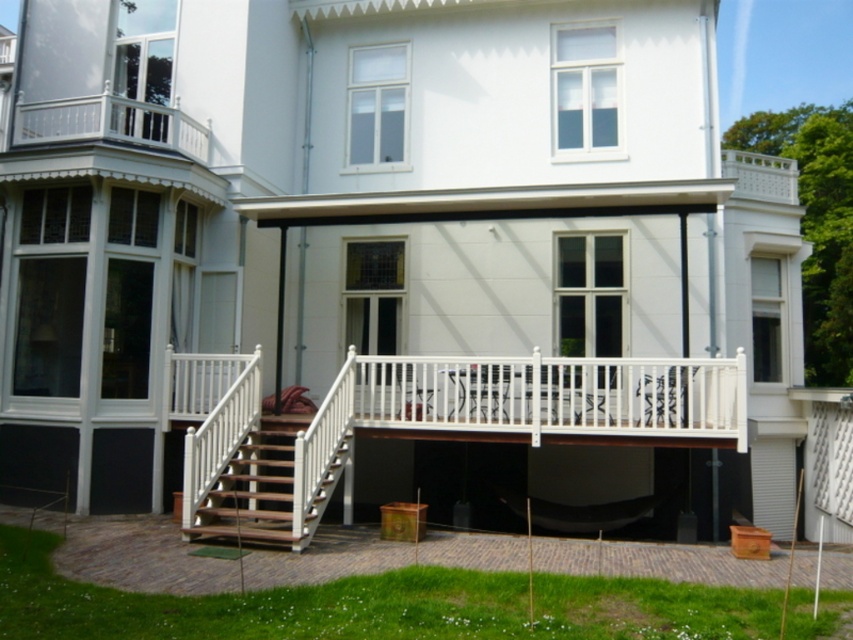
Based on the photo, which is more to the right, white wooden porch at center or brown wooden deck at lower center?

From the viewer's perspective, brown wooden deck at lower center appears more on the right side.

Does point (729, 426) come behind point (476, 541)?

That is True.

Is point (573, 413) behind point (198, 572)?

Yes, it is behind point (198, 572).

Image resolution: width=853 pixels, height=640 pixels. What are the coordinates of `white wooden porch at center` in the screenshot? It's located at (440, 426).

Who is positioned more to the right, brown wooden deck at lower center or wooden stairs at center?

brown wooden deck at lower center

I want to click on brown wooden deck at lower center, so click(x=138, y=557).

Can you confirm if white wooden porch at center is positioned to the right of wooden stairs at center?

Indeed, white wooden porch at center is positioned on the right side of wooden stairs at center.

Is white wooden porch at center closer to the viewer compared to wooden stairs at center?

That is False.

What are the coordinates of `white wooden porch at center` in the screenshot? It's located at (440, 426).